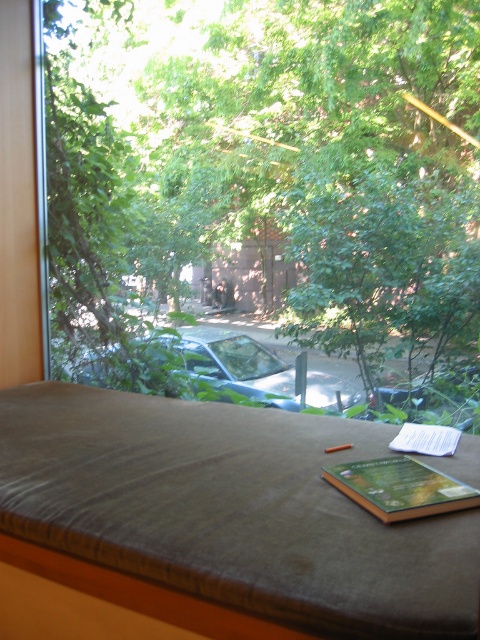
Is brown velvety bed at center smaller than metallic silver car at center?

No.

Is point (471, 602) in front of point (228, 352)?

Yes, point (471, 602) is closer to viewer.

Between point (134, 547) and point (288, 388), which one is positioned in front?

Point (134, 547) is more forward.

This screenshot has width=480, height=640. Find the location of `brown velvety bed at center`. brown velvety bed at center is located at coordinates (229, 509).

Does brown velvety bed at center appear on the left side of hardcover book at center?

Correct, you'll find brown velvety bed at center to the left of hardcover book at center.

How far apart are brown velvety bed at center and hardcover book at center?

9.40 inches

In order to click on brown velvety bed at center in this screenshot , I will do `click(229, 509)`.

Is green leafy tree at center thinner than brown velvety bed at center?

No, green leafy tree at center is not thinner than brown velvety bed at center.

Based on the photo, is green leafy tree at center to the left of brown velvety bed at center from the viewer's perspective?

In fact, green leafy tree at center is to the right of brown velvety bed at center.

Describe the element at coordinates (280, 180) in the screenshot. I see `green leafy tree at center` at that location.

Find the location of a particular element. green leafy tree at center is located at coordinates (280, 180).